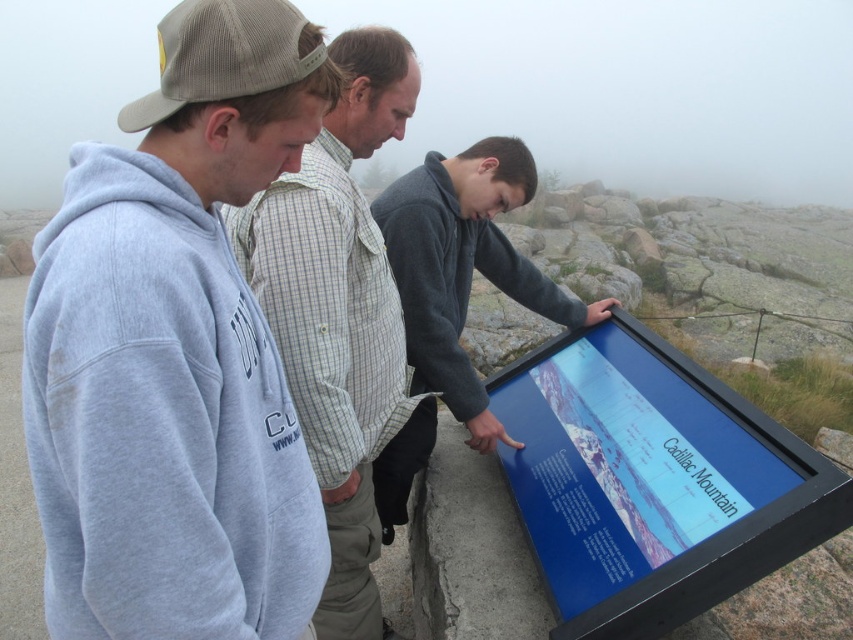
From the picture: You are standing at the scenic overlook and want to take a photo of the blue glossy tablet at center. To ensure the tablet is in focus, where should you aim your camera? Please provide coordinates based on the image grid system described in the scene.

The blue glossy tablet at center is located at coordinates point (653, 481), so aim your camera there to focus on it.

You are a tour guide leading a group at Cadillac Mountain. You notice two points marked on the informational sign. The first point is at coordinates point (163, 28) and the second is at point (695, 602). Which of these points is closer to the viewer?

Point (163, 28) is in front of point (695, 602), so it is closer to the viewer.

You are standing at the overlook and want to take a photo of the point at coordinates (x=624, y=371). The camera you are using has a minimum focus distance of 10 feet. Will you be able to capture the point clearly in your photo?

The point at coordinates (x=624, y=371) is 9.09 feet away from the camera, which is within the minimum focus distance of 10 feet. Therefore, the camera should be able to capture the point clearly.